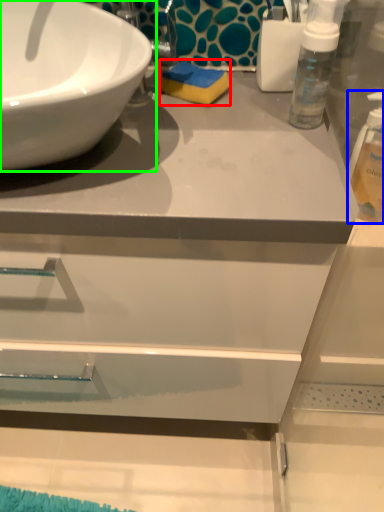
Question: Which object is positioned farthest from soap (highlighted by a red box)? Select from cleaning product (highlighted by a blue box) and sink (highlighted by a green box).

Choices:
 (A) cleaning product
 (B) sink

Answer: (A)